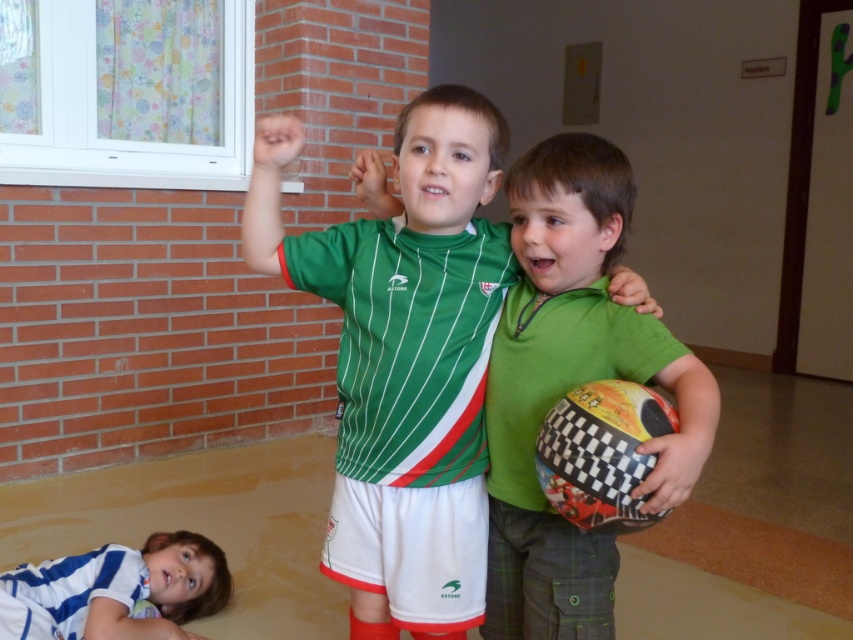
Question: Which is farther from the white striped shirt at lower left?

Choices:
 (A) green matte shirt at center
 (B) green striped jersey at center

Answer: (A)

Question: Does green matte shirt at center lie in front of white striped shirt at lower left?

Choices:
 (A) no
 (B) yes

Answer: (B)

Question: Which is farther from the green striped jersey at center?

Choices:
 (A) green matte shirt at center
 (B) white striped shirt at lower left

Answer: (B)

Question: Which is nearer to the green matte shirt at center?

Choices:
 (A) white striped shirt at lower left
 (B) green striped jersey at center

Answer: (B)

Question: Does green striped jersey at center have a smaller size compared to white striped shirt at lower left?

Choices:
 (A) yes
 (B) no

Answer: (B)

Question: Does green striped jersey at center lie in front of white striped shirt at lower left?

Choices:
 (A) no
 (B) yes

Answer: (B)